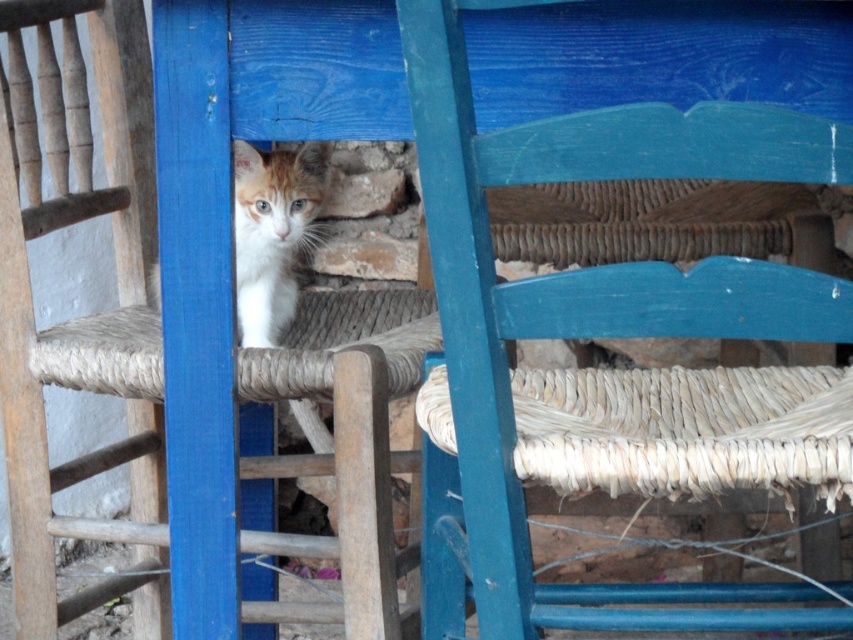
Which is more to the right, blue painted wicker chair at center or rope-woven chair at center?

From the viewer's perspective, blue painted wicker chair at center appears more on the right side.

Who is taller, blue painted wicker chair at center or rope-woven chair at center?

With more height is rope-woven chair at center.

Who is more forward, (x=643, y=19) or (x=39, y=595)?

Point (x=643, y=19) is more forward.

Where is `blue painted wicker chair at center`? Image resolution: width=853 pixels, height=640 pixels. blue painted wicker chair at center is located at coordinates (589, 284).

Is blue painted wicker chair at center taller than orange-white fur kitten at center?

Yes.

Based on the photo, how much distance is there between blue painted wicker chair at center and orange-white fur kitten at center?

They are 63.14 centimeters apart.

Which is in front, point (614, 289) or point (286, 308)?

Point (614, 289) is in front.

Locate an element on the screen. The height and width of the screenshot is (640, 853). blue painted wicker chair at center is located at coordinates (589, 284).

Is rope-woven chair at center to the right of orange-white fur kitten at center from the viewer's perspective?

Incorrect, rope-woven chair at center is not on the right side of orange-white fur kitten at center.

From the picture: Is rope-woven chair at center above orange-white fur kitten at center?

No, rope-woven chair at center is not above orange-white fur kitten at center.

This screenshot has width=853, height=640. Identify the location of rope-woven chair at center. (56, 228).